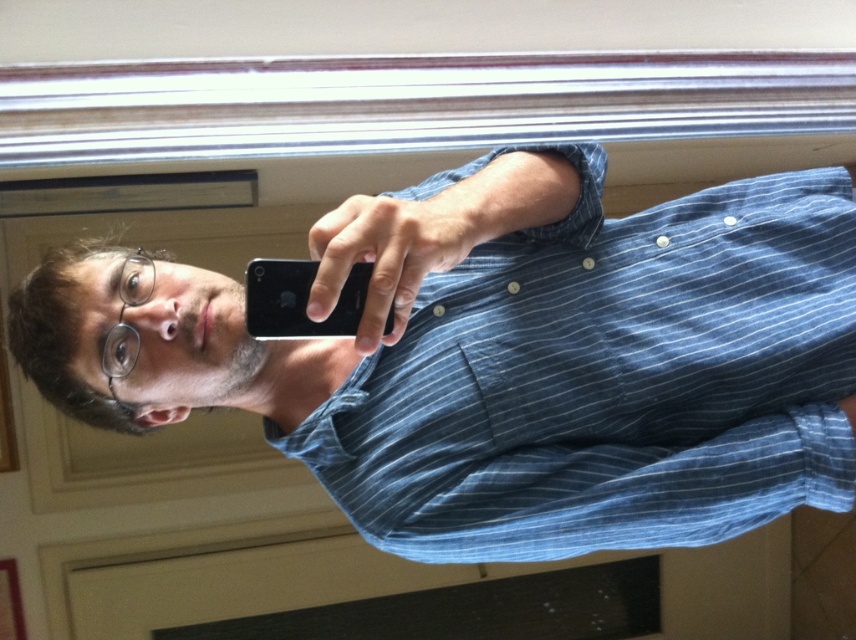
Consider the image. Does blue striped shirt at center appear on the right side of black matte smartphone at center?

Indeed, blue striped shirt at center is positioned on the right side of black matte smartphone at center.

Is point (658, 419) farther from camera compared to point (330, 320)?

That is True.

Is point (58, 337) positioned before point (281, 280)?

That is False.

At what (x,y) coordinates should I click in order to perform the action: click on blue striped shirt at center. Please return your answer as a coordinate pair (x, y). The height and width of the screenshot is (640, 856). Looking at the image, I should click on (508, 358).